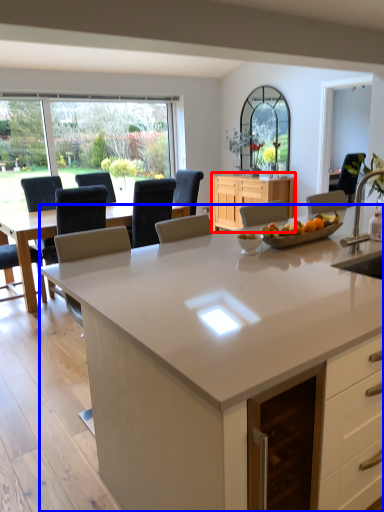
Question: Which of the following is the closest to the observer, cabinetry (highlighted by a red box) or countertop (highlighted by a blue box)?

Choices:
 (A) cabinetry
 (B) countertop

Answer: (B)